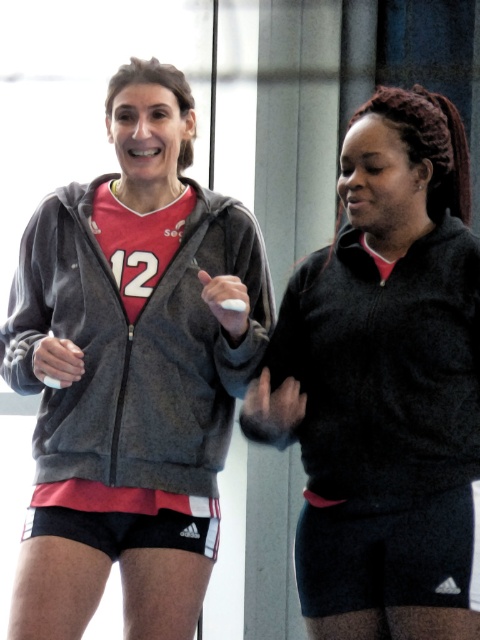
What do you see at coordinates (135, 346) in the screenshot? I see `charcoal fleece sweatshirt at left` at bounding box center [135, 346].

Does point (168, 420) come in front of point (309, 429)?

That is False.

From the picture: Who is more distant from viewer, [192,308] or [307,493]?

Positioned behind is point [192,308].

The height and width of the screenshot is (640, 480). I want to click on charcoal fleece sweatshirt at left, so click(135, 346).